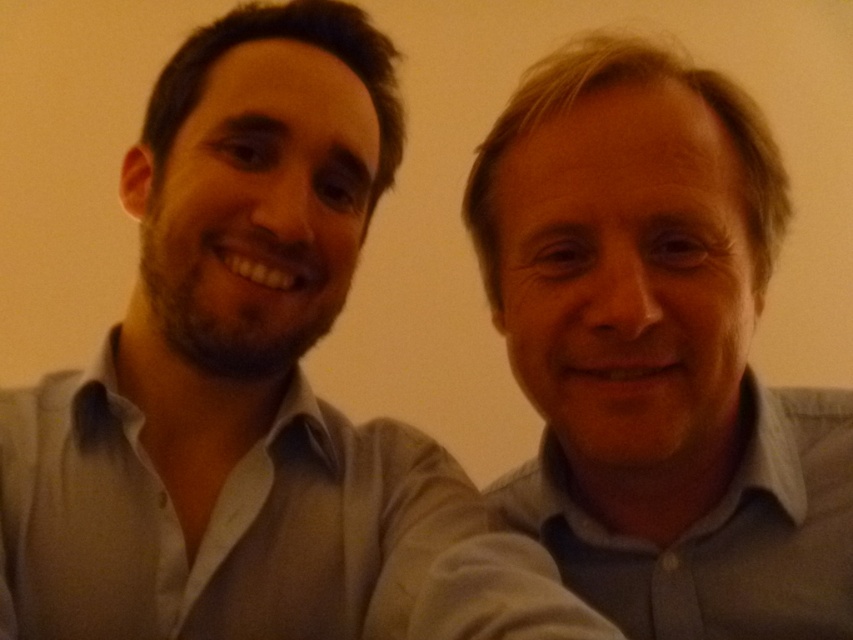
Who is more forward, (x=468, y=550) or (x=532, y=83)?

Point (x=468, y=550)

Between gray shirt at right and gray cotton shirt at right, which one appears on the right side from the viewer's perspective?

gray cotton shirt at right

Locate an element on the screen. This screenshot has height=640, width=853. gray shirt at right is located at coordinates (251, 388).